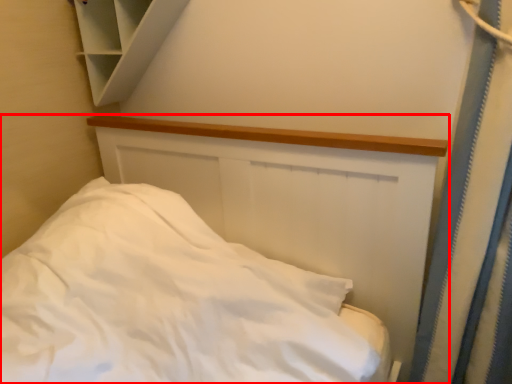
Question: From the image's perspective, where is bed (annotated by the red box) located in relation to cabinet in the image?

Choices:
 (A) above
 (B) below

Answer: (B)